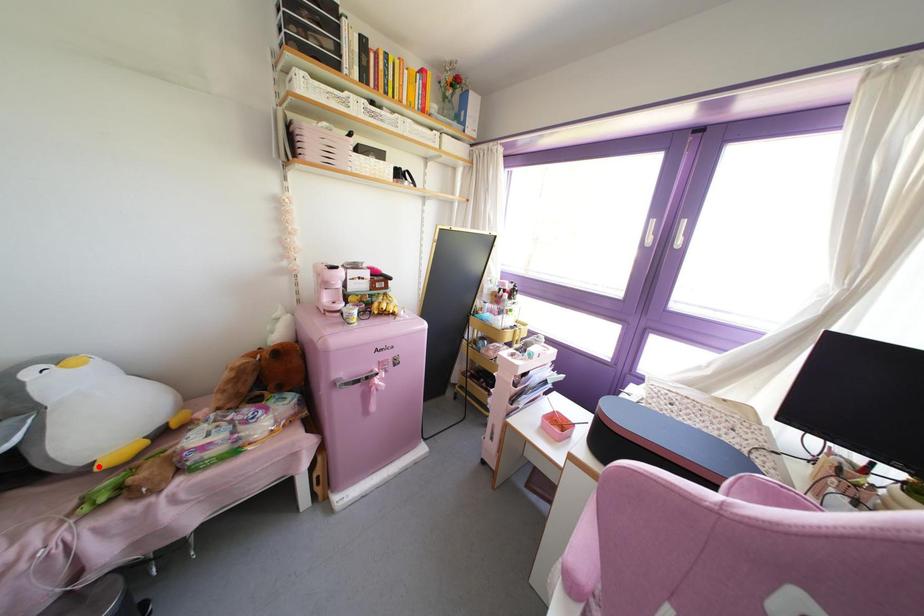
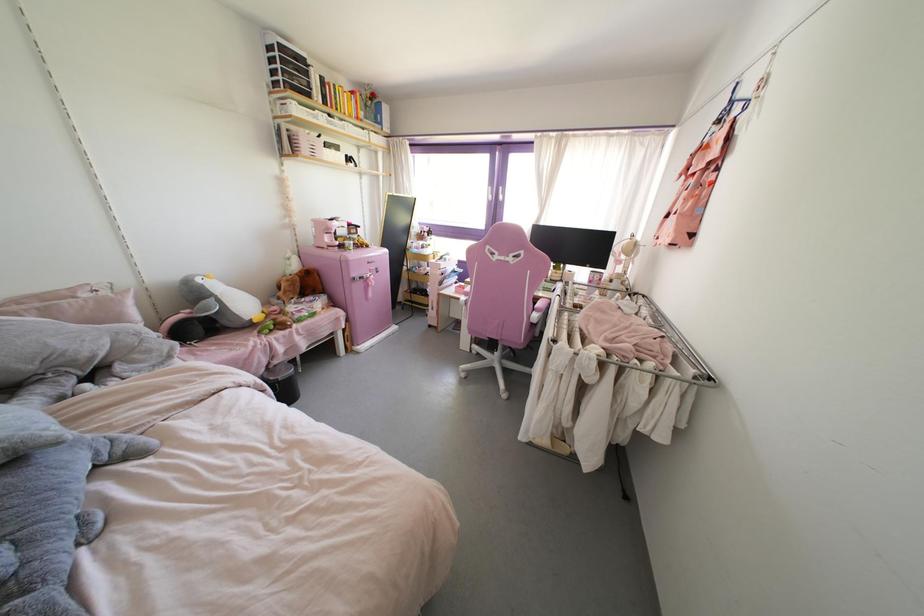
Question: I am providing you with two images of the same scene from different viewpoints. A red point is shown in image1. For the corresponding object point in image2, is it positioned nearer or farther from the camera?

Choices:
 (A) Nearer
 (B) Farther

Answer: (B)